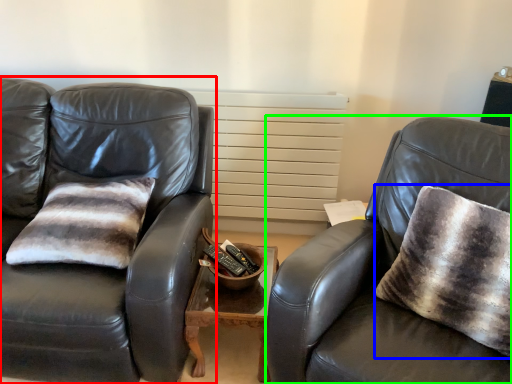
Question: Which object is the closest to the studio couch (highlighted by a red box)? Choose among these: throw pillow (highlighted by a blue box) or chair (highlighted by a green box).

Choices:
 (A) throw pillow
 (B) chair

Answer: (B)